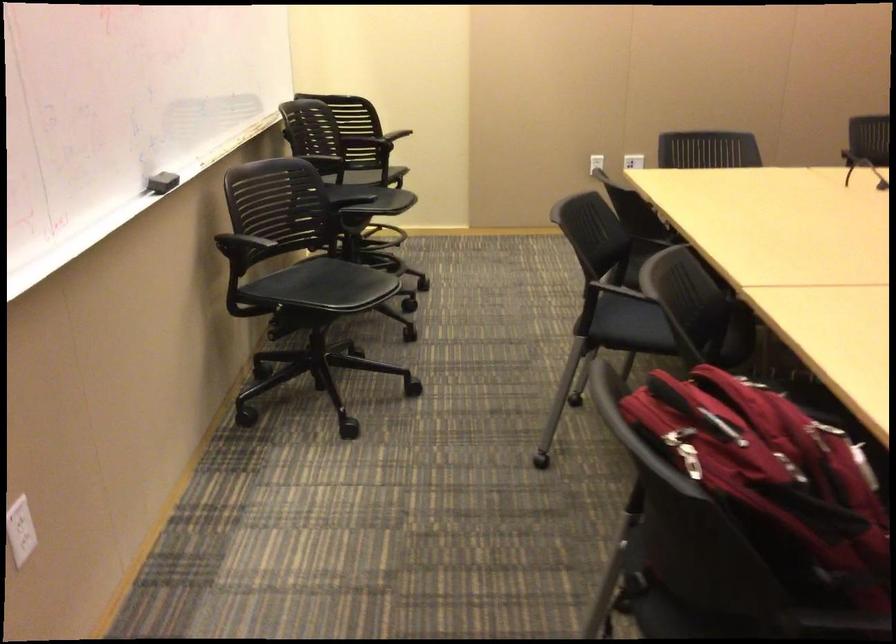
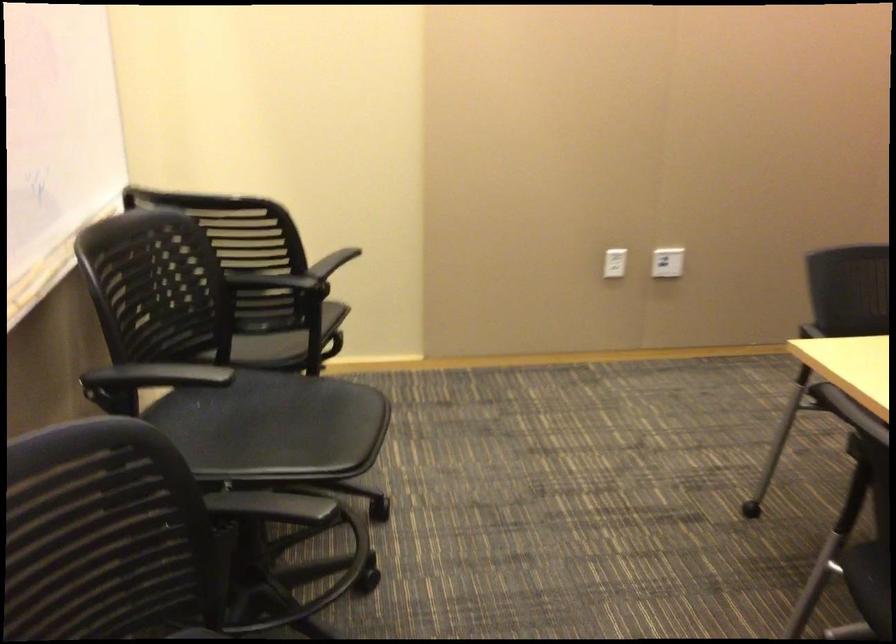
In the second image, find the point that corresponds to [377,163] in the first image.

(287, 341)